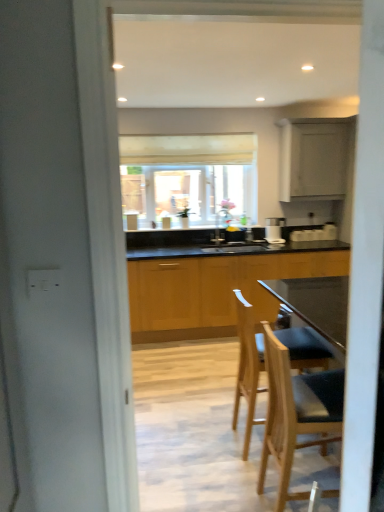
At what (x,y) coordinates should I click in order to perform the action: click on vacant space situated on the left part of light wood bar stool at center, which is the first chair in back-to-front order. Please return your answer as a coordinate pair (x, y). The image size is (384, 512). Looking at the image, I should click on (220, 455).